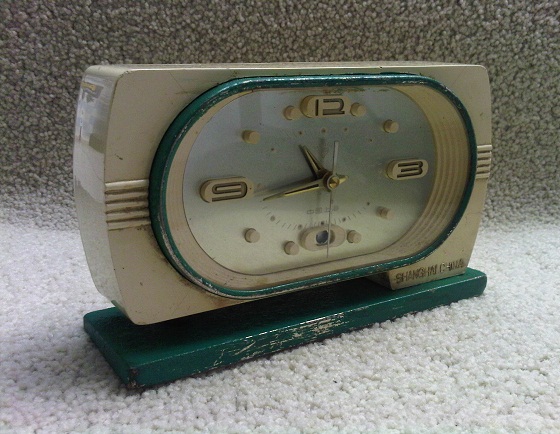
Find the location of a particular element. This screenshot has width=560, height=434. clock is located at coordinates (331, 182).